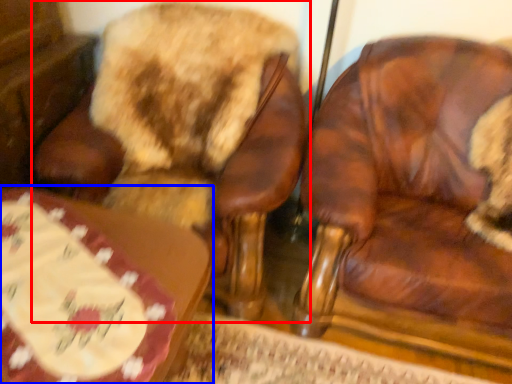
Question: Among these objects, which one is farthest to the camera, chair (highlighted by a red box) or table (highlighted by a blue box)?

Choices:
 (A) chair
 (B) table

Answer: (A)